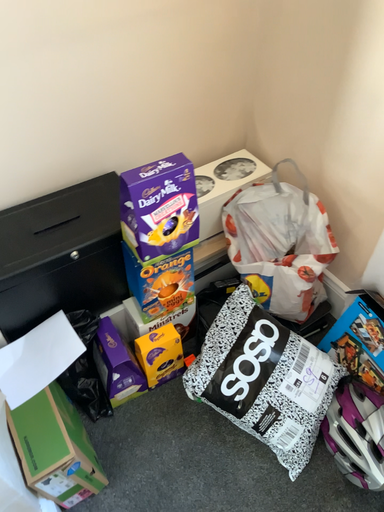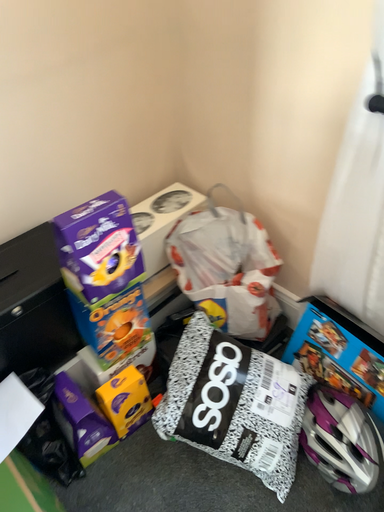
Question: How did the camera likely rotate when shooting the video?

Choices:
 (A) rotated upward
 (B) rotated downward

Answer: (A)